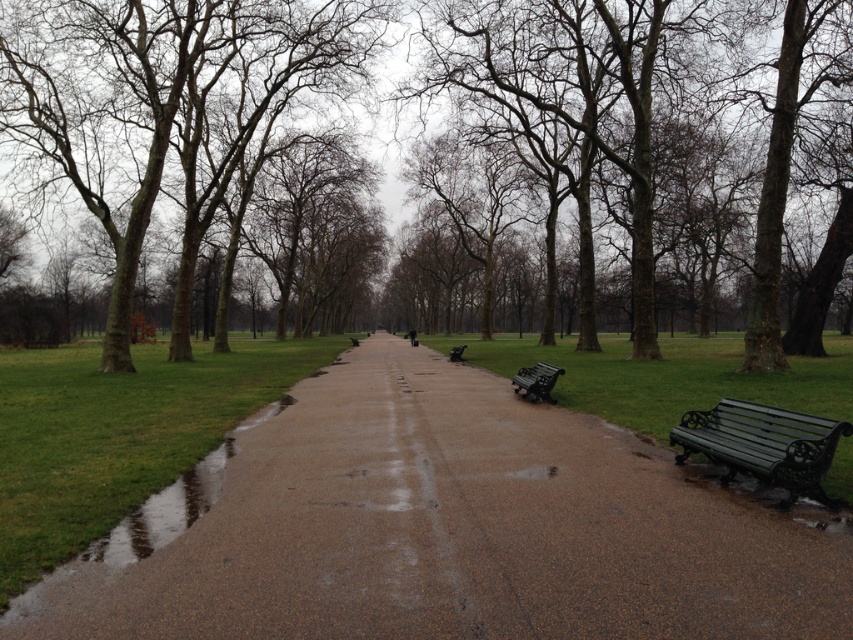
Does point (155, 596) come in front of point (543, 376)?

Yes, point (155, 596) is closer to viewer.

Is point (732, 520) behind point (527, 372)?

No.

Is point (428, 579) in front of point (544, 381)?

Yes, point (428, 579) is in front of point (544, 381).

This screenshot has width=853, height=640. I want to click on smooth asphalt path at center, so click(450, 529).

Does brown textured tree at center appear on the right side of green metal bench at lower right?

No, brown textured tree at center is not to the right of green metal bench at lower right.

Can you confirm if brown textured tree at center is positioned below green metal bench at lower right?

Incorrect, brown textured tree at center is not positioned below green metal bench at lower right.

Between point (51, 49) and point (543, 397), which one is positioned behind?

Positioned behind is point (51, 49).

Where is `brown textured tree at center`? This screenshot has width=853, height=640. brown textured tree at center is located at coordinates (161, 97).

Based on the photo, is green metal bench at lower right positioned before green metal bench at center?

Yes, green metal bench at lower right is in front of green metal bench at center.

Is point (526, 392) positioned after point (461, 360)?

No, it is in front of (461, 360).

Is point (515, 390) in front of point (462, 356)?

Yes, point (515, 390) is in front of point (462, 356).

Find the location of a particular element. The height and width of the screenshot is (640, 853). green metal bench at lower right is located at coordinates tap(537, 380).